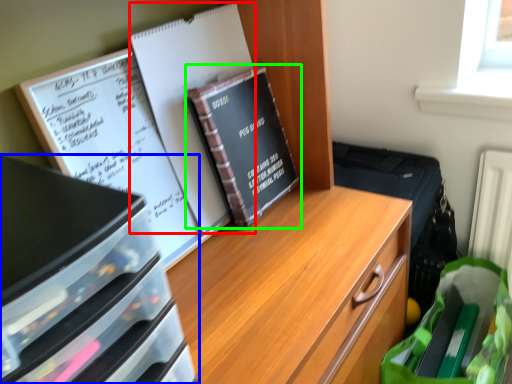
Question: Which is farther away from journal (highlighted by a red box)? desk (highlighted by a blue box) or book (highlighted by a green box)?

Choices:
 (A) desk
 (B) book

Answer: (A)